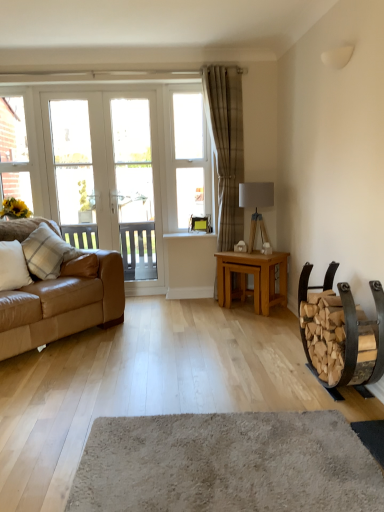
Question: Is plaid fabric pillow at left, placed as the second pillow when sorted from front to back, aimed at beige textured curtain at center?

Choices:
 (A) no
 (B) yes

Answer: (A)

Question: Is plaid fabric pillow at left, marked as the 1th pillow in a back-to-front arrangement, at the right side of beige textured curtain at center?

Choices:
 (A) yes
 (B) no

Answer: (B)

Question: From the image's perspective, is plaid fabric pillow at left, marked as the 1th pillow in a back-to-front arrangement, on beige textured curtain at center?

Choices:
 (A) no
 (B) yes

Answer: (A)

Question: Does plaid fabric pillow at left, placed as the second pillow when sorted from front to back, have a larger size compared to beige textured curtain at center?

Choices:
 (A) yes
 (B) no

Answer: (B)

Question: Can you confirm if plaid fabric pillow at left, placed as the second pillow when sorted from front to back, is taller than beige textured curtain at center?

Choices:
 (A) no
 (B) yes

Answer: (A)

Question: Visually, is soft beige carpet at center positioned to the left or to the right of light oak table at center?

Choices:
 (A) left
 (B) right

Answer: (A)

Question: Would you say soft beige carpet at center is inside or outside light oak table at center?

Choices:
 (A) inside
 (B) outside

Answer: (B)

Question: Considering their positions, is soft beige carpet at center located in front of or behind light oak table at center?

Choices:
 (A) behind
 (B) front

Answer: (B)

Question: From a real-world perspective, is soft beige carpet at center above or below light oak table at center?

Choices:
 (A) below
 (B) above

Answer: (A)

Question: From a real-world perspective, relative to beige textured curtain at center, is white plastic window frame at upper left, the 2th window frame viewed from the right, vertically above or below?

Choices:
 (A) below
 (B) above

Answer: (B)

Question: Considering their positions, is white plastic window frame at upper left, the 2th window frame viewed from the right, located in front of or behind beige textured curtain at center?

Choices:
 (A) front
 (B) behind

Answer: (B)

Question: In terms of width, does white plastic window frame at upper left, the 2th window frame viewed from the right, look wider or thinner when compared to beige textured curtain at center?

Choices:
 (A) wide
 (B) thin

Answer: (B)

Question: Looking at the image, does white plastic window frame at upper left, which is the 1th window frame in left-to-right order, seem bigger or smaller compared to beige textured curtain at center?

Choices:
 (A) big
 (B) small

Answer: (B)

Question: In the image, is matte gray lamp at center positioned in front of or behind wooden log rack at right?

Choices:
 (A) behind
 (B) front

Answer: (A)

Question: Based on their positions, is matte gray lamp at center located to the left or right of wooden log rack at right?

Choices:
 (A) left
 (B) right

Answer: (A)